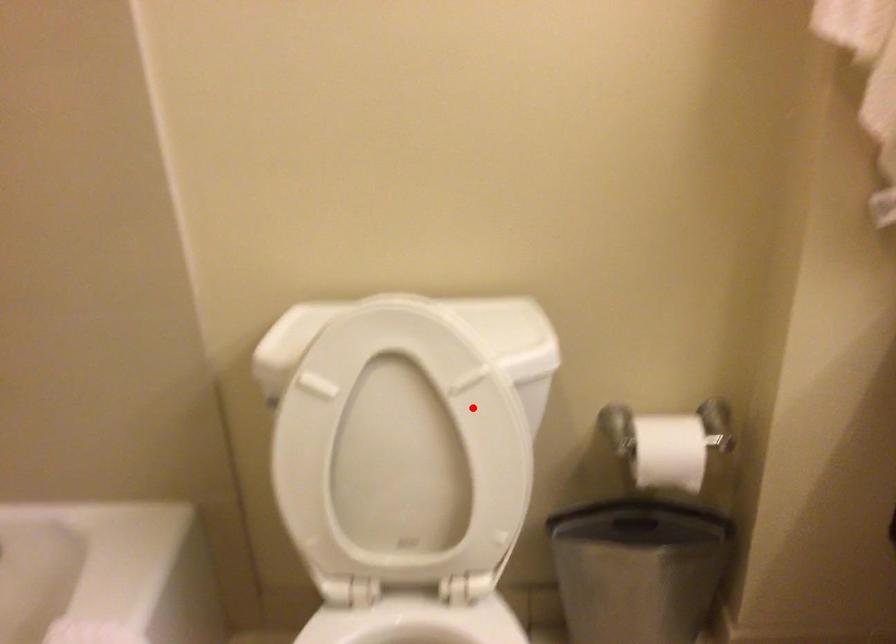
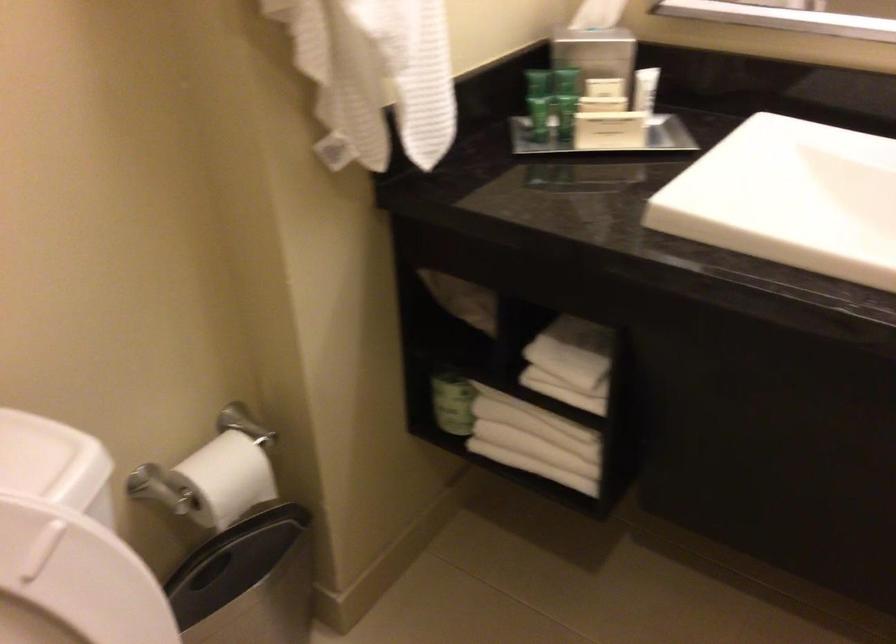
Question: I am providing you with two images of the same scene from different viewpoints. Given a red point in image1, look at the same physical point in image2. Is it:

Choices:
 (A) Closer to the viewpoint
 (B) Farther from the viewpoint

Answer: (A)